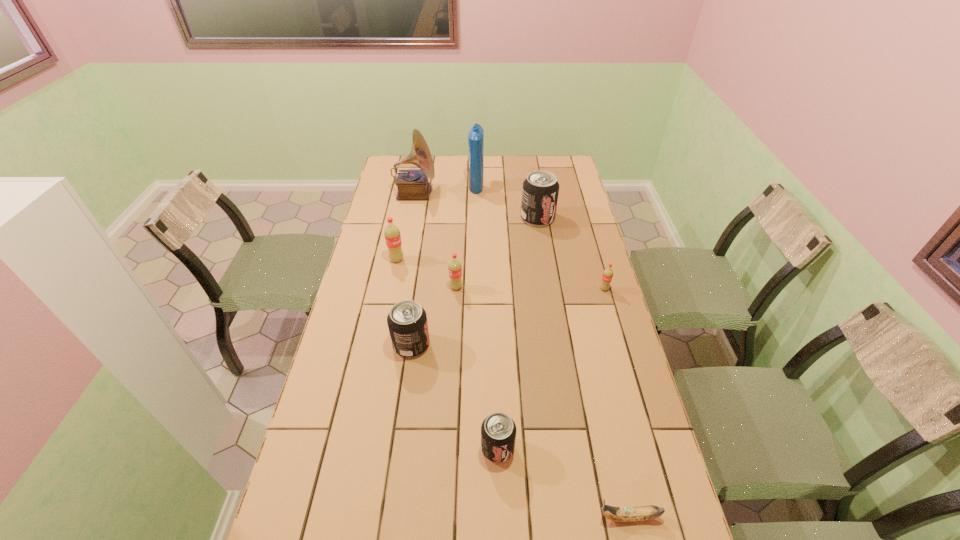
The width and height of the screenshot is (960, 540). Identify the location of soda located at the left edge. (392, 235).

The width and height of the screenshot is (960, 540). I want to click on banana present at the right edge, so click(x=619, y=514).

Locate an element on the screen. object positioned at the far left corner is located at coordinates (412, 184).

At what (x,y) coordinates should I click in order to perform the action: click on free space at the left edge of the desktop. Please return your answer as a coordinate pair (x, y). The width and height of the screenshot is (960, 540). Looking at the image, I should click on (373, 245).

Image resolution: width=960 pixels, height=540 pixels. Find the location of `vacant area at the right edge of the desktop`. vacant area at the right edge of the desktop is located at coordinates (560, 207).

At what (x,y) coordinates should I click in order to perform the action: click on vacant space at the far right corner. Please return your answer as a coordinate pair (x, y). The height and width of the screenshot is (540, 960). Looking at the image, I should click on (554, 157).

The image size is (960, 540). In order to click on free space that is in between the farthest black soda can and the shampoo in this screenshot , I will do `click(507, 201)`.

I want to click on blank region between the farthest soda can and the third soda can from left to right, so click(497, 253).

At what (x,y) coordinates should I click in order to perform the action: click on free spot between the rightmost red soda and the farthest red soda. Please return your answer as a coordinate pair (x, y). Image resolution: width=960 pixels, height=540 pixels. Looking at the image, I should click on (500, 274).

You are a GUI agent. You are given a task and a screenshot of the screen. Output one action in this format:
    pyautogui.click(x=<x>, y=<y>)
    Task: Click on the empty space between the rightmost red soda and the second farthest soda can
    
    Given the screenshot: What is the action you would take?
    pyautogui.click(x=500, y=274)